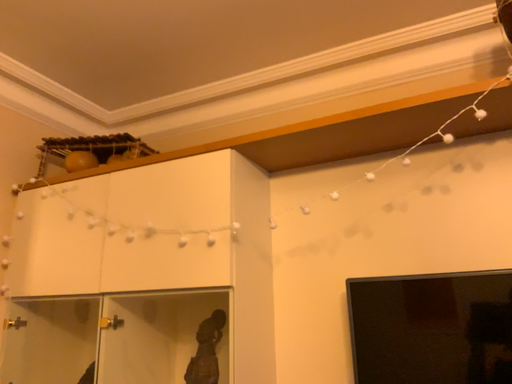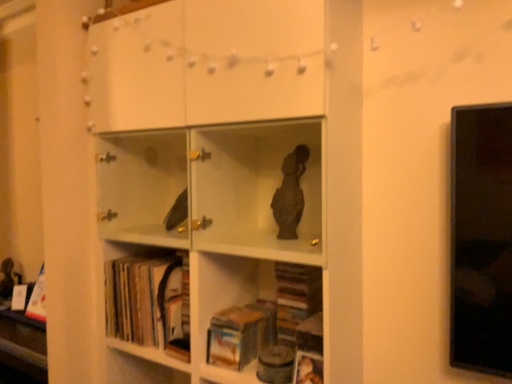
Question: Which way did the camera rotate in the video?

Choices:
 (A) rotated right
 (B) rotated left

Answer: (B)